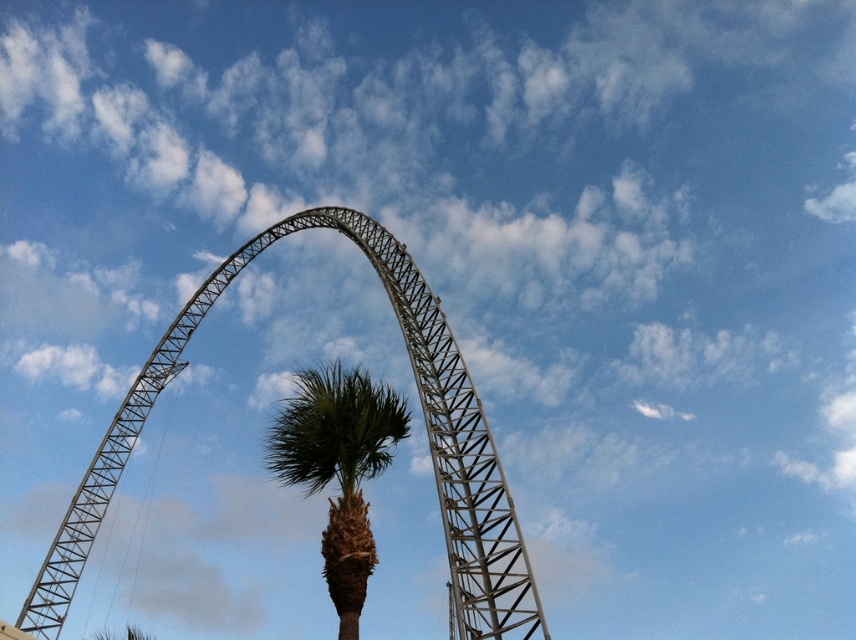
Can you confirm if metallic structure at center is wider than green leafy palm tree at center?

Correct, the width of metallic structure at center exceeds that of green leafy palm tree at center.

Can you confirm if metallic structure at center is positioned above green leafy palm tree at center?

Correct, metallic structure at center is located above green leafy palm tree at center.

What do you see at coordinates (175, 364) in the screenshot?
I see `metallic structure at center` at bounding box center [175, 364].

At what (x,y) coordinates should I click in order to perform the action: click on metallic structure at center. Please return your answer as a coordinate pair (x, y). The height and width of the screenshot is (640, 856). Looking at the image, I should click on (175, 364).